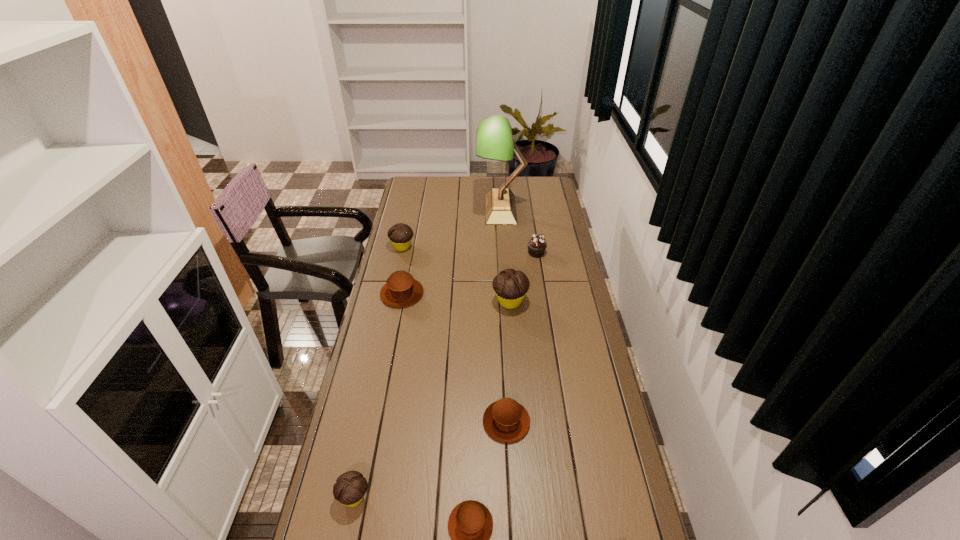
In order to click on vacant space located on the right of the nearest chocolate muffin in this screenshot , I will do `click(516, 497)`.

Locate an element on the screen. This screenshot has width=960, height=540. object situated at the far edge is located at coordinates (494, 140).

This screenshot has width=960, height=540. I want to click on object that is at the right edge, so click(537, 244).

What are the coordinates of `vacant region at the far edge of the desktop` in the screenshot? It's located at 461,196.

The image size is (960, 540). I want to click on free space at the left edge of the desktop, so click(x=387, y=316).

Identify the location of vacant space at the right edge of the desktop. The height and width of the screenshot is (540, 960). [x=562, y=210].

You are a GUI agent. You are given a task and a screenshot of the screen. Output one action in this format:
    pyautogui.click(x=<x>, y=<y>)
    Task: Click on the vacant region at the far left corner of the desktop
    This screenshot has width=960, height=540.
    Given the screenshot: What is the action you would take?
    pyautogui.click(x=420, y=184)

Find the location of a particular element. This screenshot has height=540, width=960. free space at the far right corner of the desktop is located at coordinates (553, 184).

You are a GUI agent. You are given a task and a screenshot of the screen. Output one action in this format:
    pyautogui.click(x=<x>, y=<y>)
    Task: Click on the free space that is in between the second biggest brown muffin and the smallest chocolate muffin
    This screenshot has height=540, width=960.
    Given the screenshot: What is the action you would take?
    (430, 460)

Identify the location of blank region between the farthest chocolate muffin and the tallest object. (451, 228).